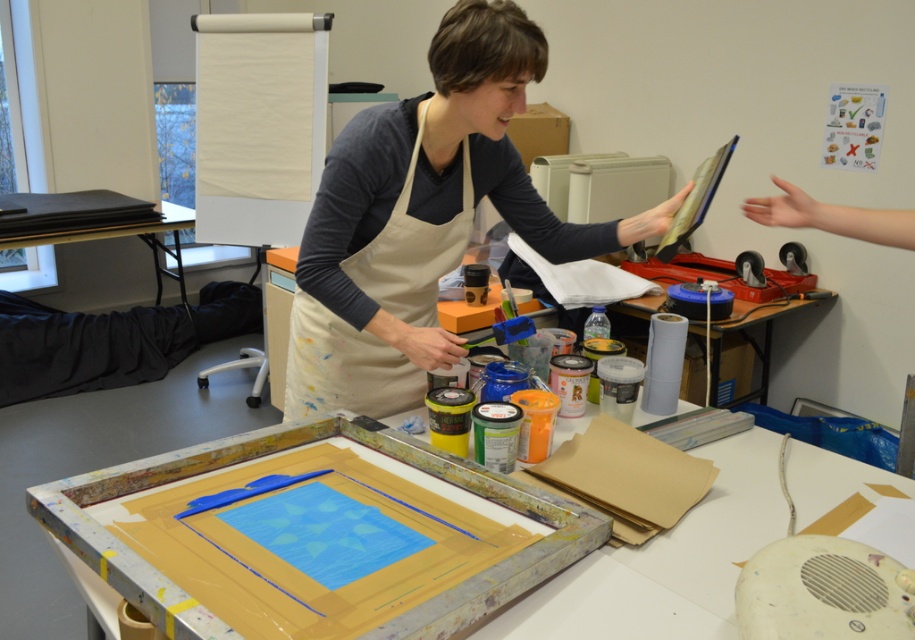
Is matte apron at center thinner than beige cotton apron at center?

Incorrect, matte apron at center's width is not less than beige cotton apron at center's.

Is point (411, 145) positioned in front of point (401, 204)?

Yes, point (411, 145) is closer to viewer.

This screenshot has width=915, height=640. In order to click on matte apron at center in this screenshot , I will do `click(423, 218)`.

Between matte apron at center and black paper at left, which one appears on the right side from the viewer's perspective?

From the viewer's perspective, matte apron at center appears more on the right side.

Is matte apron at center thinner than black paper at left?

No.

Which is behind, point (384, 246) or point (178, 218)?

Positioned behind is point (178, 218).

The width and height of the screenshot is (915, 640). What are the coordinates of `matte apron at center` in the screenshot? It's located at [423, 218].

Can you confirm if wooden table at center is taller than black paper at left?

Incorrect, wooden table at center's height is not larger of black paper at left's.

Who is more forward, [399,436] or [125,196]?

Positioned in front is point [399,436].

Where is `wooden table at center`? wooden table at center is located at coordinates (669, 561).